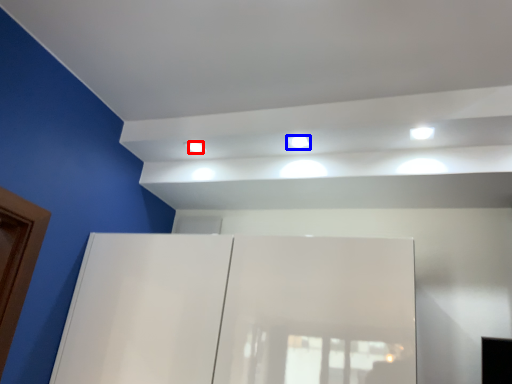
Question: Which object is further to the camera taking this photo, dot (highlighted by a red box) or light (highlighted by a blue box)?

Choices:
 (A) dot
 (B) light

Answer: (A)